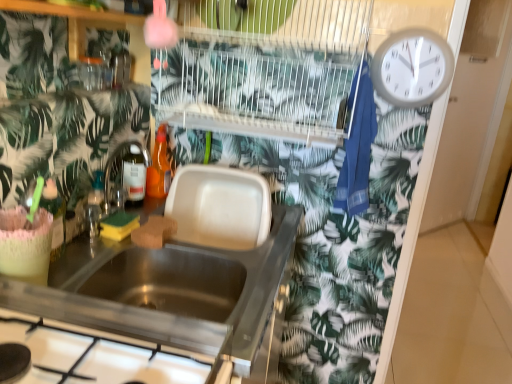
Measure the distance between green sponge at sink, arranged as the second food when viewed from the right, and camera.

They are 3.83 feet apart.

Locate an element on the screen. The height and width of the screenshot is (384, 512). white wire bird cage at upper center is located at coordinates (263, 67).

The width and height of the screenshot is (512, 384). What do you see at coordinates (263, 67) in the screenshot? I see `white wire bird cage at upper center` at bounding box center [263, 67].

The image size is (512, 384). What are the coordinates of `stainless steel gas stove at lower left` in the screenshot? It's located at (137, 366).

This screenshot has height=384, width=512. Describe the element at coordinates (137, 366) in the screenshot. I see `stainless steel gas stove at lower left` at that location.

Measure the distance between translucent orange bottle at sink, placed as the 2th bottle when sorted from bottom to top, and camera.

They are 1.52 meters apart.

I want to click on brown sponge at sink, acting as the 2th food starting from the left, so click(x=154, y=232).

Identify the location of green sponge at sink, arranged as the second food when viewed from the right. (119, 225).

Is white wire bird cage at upper center turned away from stainless steel gas stove at lower left?

No, white wire bird cage at upper center is not facing the opposite direction of stainless steel gas stove at lower left.

Image resolution: width=512 pixels, height=384 pixels. In the image, there is a white wire bird cage at upper center. What are the coordinates of `gas stove below it (from the image's perspective)` in the screenshot? It's located at (137, 366).

Is point (311, 41) positioned behind point (97, 348)?

Yes.

Which object is thinner, white wire bird cage at upper center or stainless steel gas stove at lower left?

white wire bird cage at upper center.

Is translucent orange bottle at sink, acting as the first bottle starting from the right, touching translucent plastic bottle at left, the first bottle when ordered from bottom to top?

No, translucent orange bottle at sink, acting as the first bottle starting from the right, is not making contact with translucent plastic bottle at left, the first bottle when ordered from bottom to top.

Is translucent orange bottle at sink, which is the first bottle in top-to-bottom order, bigger or smaller than translucent plastic bottle at left, the first bottle when ordered from bottom to top?

Considering their sizes, translucent orange bottle at sink, which is the first bottle in top-to-bottom order, takes up more space than translucent plastic bottle at left, the first bottle when ordered from bottom to top.

From the image's perspective, between translucent orange bottle at sink, acting as the first bottle starting from the right, and translucent plastic bottle at left, which is the 1th bottle from left to right, who is located below?

translucent plastic bottle at left, which is the 1th bottle from left to right, is shown below in the image.

Do you think translucent orange bottle at sink, acting as the first bottle starting from the right, is within translucent plastic bottle at left, the first bottle when ordered from bottom to top, or outside of it?

translucent orange bottle at sink, acting as the first bottle starting from the right, lies outside translucent plastic bottle at left, the first bottle when ordered from bottom to top.

Is point (85, 272) closer to camera compared to point (417, 80)?

Yes, point (85, 272) is closer to viewer.

In the scene shown: Looking at their sizes, would you say metallic stainless steel sink at center is wider or thinner than white plastic wall clock at upper right?

Clearly, metallic stainless steel sink at center has more width compared to white plastic wall clock at upper right.

How much distance is there between metallic stainless steel sink at center and white plastic wall clock at upper right?

metallic stainless steel sink at center is 29.84 inches away from white plastic wall clock at upper right.

Is the position of metallic stainless steel sink at center more distant than that of white plastic wall clock at upper right?

That is False.

Do you think translucent orange bottle at sink, the 1th bottle positioned from the back, is within white plastic wall clock at upper right, or outside of it?

translucent orange bottle at sink, the 1th bottle positioned from the back, is spatially situated outside white plastic wall clock at upper right.

Does point (148, 183) appear closer or farther from the camera than point (373, 61)?

Point (148, 183) appears to be farther away from the viewer than point (373, 61).

Looking at this image, which of these two, translucent orange bottle at sink, which is the second bottle from left to right, or white plastic wall clock at upper right, stands shorter?

translucent orange bottle at sink, which is the second bottle from left to right.

From a real-world perspective, is metallic stainless steel sink at center positioned above or below translucent plastic bottle at left, the first bottle when ordered from bottom to top?

From a real-world perspective, metallic stainless steel sink at center is physically below translucent plastic bottle at left, the first bottle when ordered from bottom to top.

In the scene shown: How far apart are metallic stainless steel sink at center and translucent plastic bottle at left, the second bottle in the back-to-front sequence?

metallic stainless steel sink at center and translucent plastic bottle at left, the second bottle in the back-to-front sequence, are 12.64 inches apart from each other.

From the image's perspective, would you say metallic stainless steel sink at center is positioned over translucent plastic bottle at left, which is the 1th bottle from left to right?

No, from the image's perspective, metallic stainless steel sink at center is not on top of translucent plastic bottle at left, which is the 1th bottle from left to right.

Relative to translucent plastic bottle at left, the first bottle when ordered from bottom to top, is metallic stainless steel sink at center in front or behind?

Clearly, metallic stainless steel sink at center is in front of translucent plastic bottle at left, the first bottle when ordered from bottom to top.

Is white wire bird cage at upper center wider or thinner than satin silver faucet at left?

In the image, white wire bird cage at upper center appears to be wider than satin silver faucet at left.

From the image's perspective, would you say white wire bird cage at upper center is positioned over satin silver faucet at left?

Yes, from the image's perspective, white wire bird cage at upper center is on top of satin silver faucet at left.

Can we say white wire bird cage at upper center lies outside satin silver faucet at left?

white wire bird cage at upper center lies outside satin silver faucet at left's area.

From the picture: Is white wire bird cage at upper center oriented towards satin silver faucet at left?

No, white wire bird cage at upper center is not turned towards satin silver faucet at left.

From a real-world perspective, is green sponge at sink, positioned as the first food in left-to-right order, positioned above or below metallic stainless steel sink at center?

green sponge at sink, positioned as the first food in left-to-right order, is situated higher than metallic stainless steel sink at center in the real world.

Who is more distant, green sponge at sink, positioned as the first food in left-to-right order, or metallic stainless steel sink at center?

green sponge at sink, positioned as the first food in left-to-right order, is behind.

Which is more to the right, green sponge at sink, positioned as the first food in left-to-right order, or metallic stainless steel sink at center?

metallic stainless steel sink at center.

At what (x,y) coordinates should I click in order to perform the action: click on gas stove beneath the white wire bird cage at upper center (from a real-world perspective). Please return your answer as a coordinate pair (x, y). Looking at the image, I should click on (137, 366).

You are a GUI agent. You are given a task and a screenshot of the screen. Output one action in this format:
    pyautogui.click(x=<x>, y=<y>)
    Task: Click on the bottle behind the translucent plastic bottle at left, the second bottle in the back-to-front sequence
    The width and height of the screenshot is (512, 384).
    Given the screenshot: What is the action you would take?
    pyautogui.click(x=159, y=167)

Considering their positions, is metallic stainless steel sink at center positioned closer to translucent plastic bottle at left, the second bottle in the back-to-front sequence, than green sponge at sink, positioned as the first food in left-to-right order?

green sponge at sink, positioned as the first food in left-to-right order, is positioned closer to the anchor translucent plastic bottle at left, the second bottle in the back-to-front sequence.

Based on their spatial positions, is green sponge at sink, positioned as the first food in left-to-right order, or translucent orange bottle at sink, arranged as the 2th bottle when viewed from the front, closer to white plastic wall clock at upper right?

Among the two, translucent orange bottle at sink, arranged as the 2th bottle when viewed from the front, is located nearer to white plastic wall clock at upper right.

Which object lies further to the anchor point translucent plastic bottle at left, which is the 1th bottle from left to right, green sponge at sink, arranged as the second food when viewed from the right, or satin silver faucet at left?

The object further to translucent plastic bottle at left, which is the 1th bottle from left to right, is satin silver faucet at left.

In the scene shown: When comparing their distances from white wire bird cage at upper center, does brown sponge at sink, placed as the first food when sorted from right to left, or green sponge at sink, arranged as the second food when viewed from the right, seem closer?

Among the two, brown sponge at sink, placed as the first food when sorted from right to left, is located nearer to white wire bird cage at upper center.

Considering their positions, is metallic stainless steel sink at center positioned closer to green sponge at sink, arranged as the second food when viewed from the right, than white plastic wall clock at upper right?

metallic stainless steel sink at center lies closer to green sponge at sink, arranged as the second food when viewed from the right, than the other object.

Based on their spatial positions, is white wire bird cage at upper center or satin silver faucet at left closer to brown sponge at sink, placed as the first food when sorted from right to left?

satin silver faucet at left is positioned closer to the anchor brown sponge at sink, placed as the first food when sorted from right to left.

Based on their spatial positions, is brown sponge at sink, placed as the first food when sorted from right to left, or green sponge at sink, arranged as the second food when viewed from the right, closer to stainless steel gas stove at lower left?

The object closer to stainless steel gas stove at lower left is brown sponge at sink, placed as the first food when sorted from right to left.

When comparing their distances from metallic stainless steel sink at center, does translucent orange bottle at sink, the 1th bottle positioned from the back, or stainless steel gas stove at lower left seem closer?

stainless steel gas stove at lower left.

The image size is (512, 384). What are the coordinates of `bottle that lies between satin silver faucet at left and metallic stainless steel sink at center from top to bottom` in the screenshot? It's located at (54, 216).

This screenshot has width=512, height=384. Find the location of `bird cage between satin silver faucet at left and white plastic wall clock at upper right in the horizontal direction`. bird cage between satin silver faucet at left and white plastic wall clock at upper right in the horizontal direction is located at coordinates (263, 67).

Where is `bottle between stainless steel gas stove at lower left and translucent orange bottle at sink, which is the second bottle from left to right, from front to back`? The width and height of the screenshot is (512, 384). bottle between stainless steel gas stove at lower left and translucent orange bottle at sink, which is the second bottle from left to right, from front to back is located at coordinates (54, 216).

You are a GUI agent. You are given a task and a screenshot of the screen. Output one action in this format:
    pyautogui.click(x=<x>, y=<y>)
    Task: Click on the faucet between white wire bird cage at upper center and green sponge at sink, arranged as the second food when viewed from the right, in the vertical direction
    The width and height of the screenshot is (512, 384).
    Given the screenshot: What is the action you would take?
    pyautogui.click(x=126, y=174)